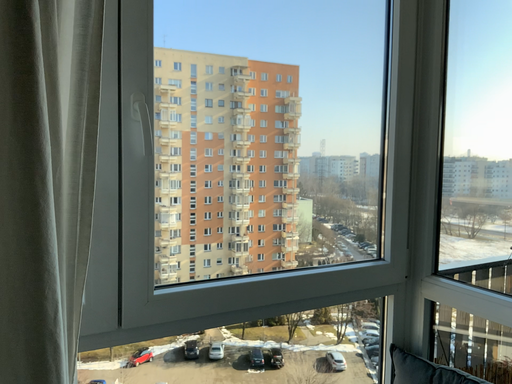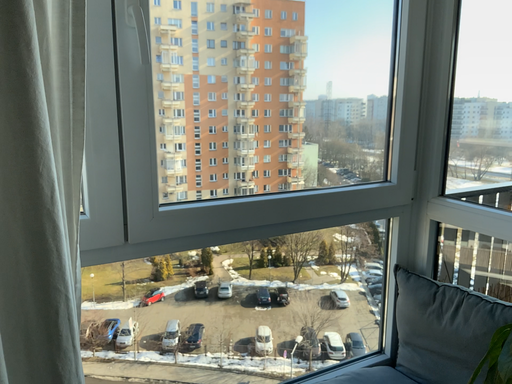
Question: Which way did the camera rotate in the video?

Choices:
 (A) rotated downward
 (B) rotated upward

Answer: (A)